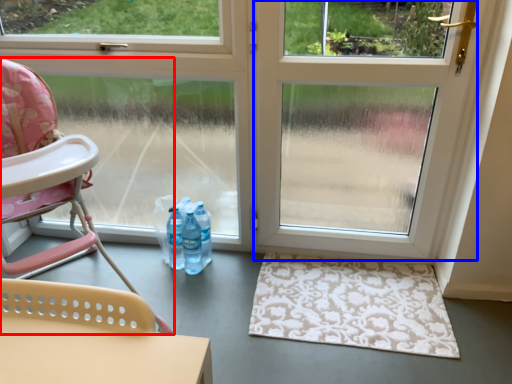
Question: Which of the following is the closest to the observer, chair (highlighted by a red box) or screen door (highlighted by a blue box)?

Choices:
 (A) chair
 (B) screen door

Answer: (A)